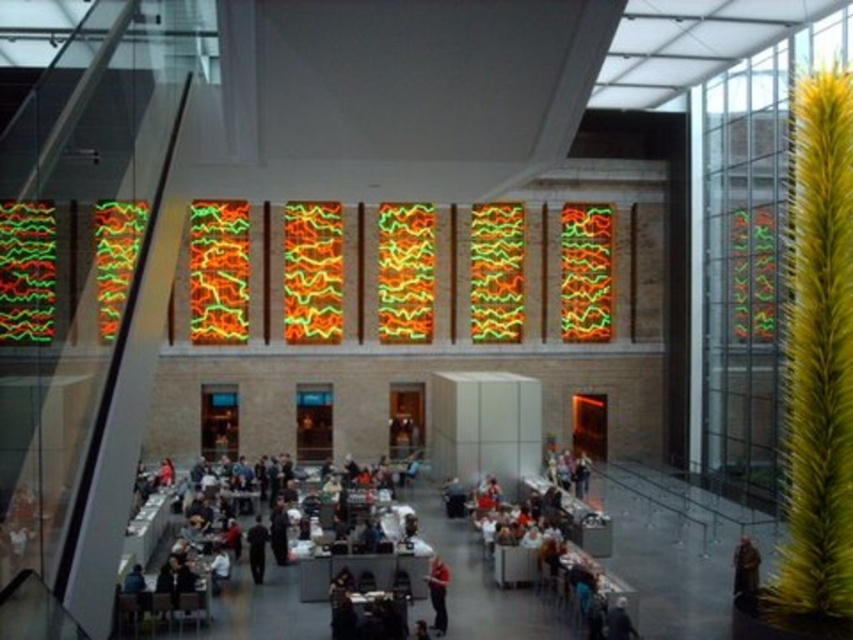
Does dark gray suit at center appear over dark blue fabric at center?

Incorrect, dark gray suit at center is not positioned above dark blue fabric at center.

Does dark gray suit at center lie behind dark blue fabric at center?

No, it is not.

Which is in front, point (416, 572) or point (253, 525)?

Point (416, 572) is more forward.

Find the location of a particular element. This screenshot has height=640, width=853. dark gray suit at center is located at coordinates (372, 592).

Is dark gray suit at center below matte orange shirt at center?

Incorrect, dark gray suit at center is not positioned below matte orange shirt at center.

Is the position of dark gray suit at center less distant than that of matte orange shirt at center?

Yes, it is in front of matte orange shirt at center.

Locate an element on the screen. Image resolution: width=853 pixels, height=640 pixels. dark gray suit at center is located at coordinates (372, 592).

Can you confirm if matte orange shirt at center is positioned above dark blue fabric at center?

No, matte orange shirt at center is not above dark blue fabric at center.

Does matte orange shirt at center have a smaller size compared to dark blue fabric at center?

Yes, matte orange shirt at center is smaller than dark blue fabric at center.

Who is more distant from viewer, (442, 577) or (252, 572)?

The point (252, 572) is more distant.

You are a GUI agent. You are given a task and a screenshot of the screen. Output one action in this format:
    pyautogui.click(x=<x>, y=<y>)
    Task: Click on the matte orange shirt at center
    
    Given the screenshot: What is the action you would take?
    pyautogui.click(x=438, y=593)